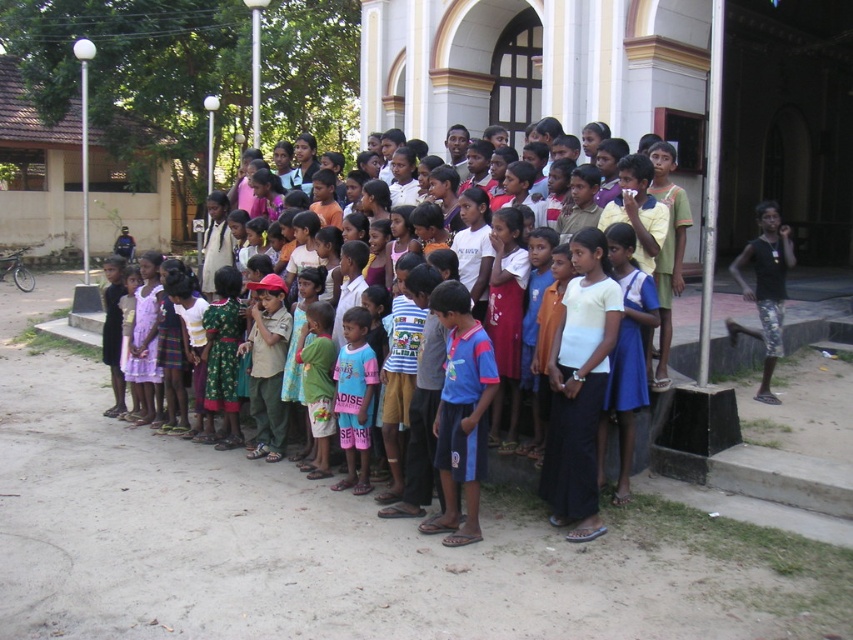
Is multicolored clothing at center wider than camouflage-patterned shorts at right?

No, multicolored clothing at center is not wider than camouflage-patterned shorts at right.

Who is lower down, multicolored clothing at center or camouflage-patterned shorts at right?

multicolored clothing at center is below.

This screenshot has height=640, width=853. What are the coordinates of `multicolored clothing at center` in the screenshot? It's located at (582, 412).